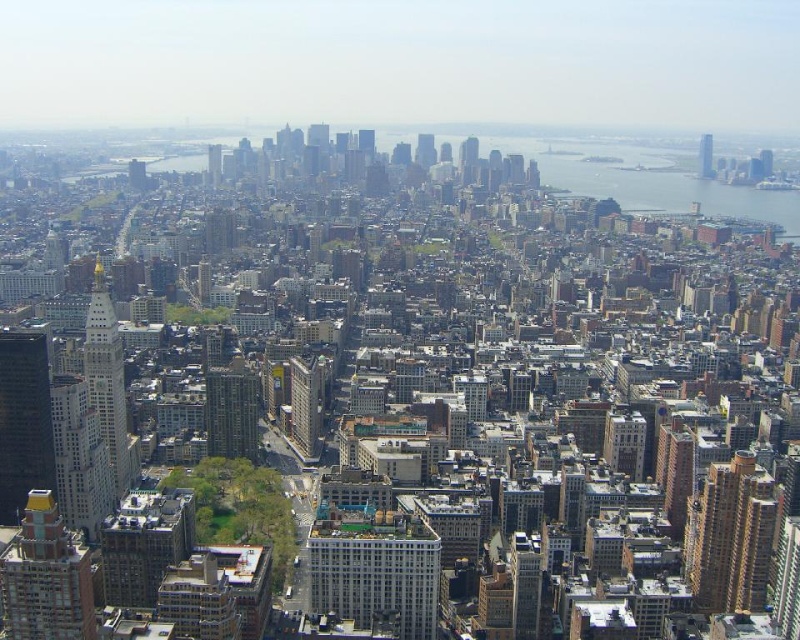
Question: Can you confirm if white glass skyscraper at left is positioned to the left of matte glass skyscraper at center?

Choices:
 (A) no
 (B) yes

Answer: (B)

Question: Which point is closer to the camera?

Choices:
 (A) green glass building at center
 (B) matte gray building at center
 (C) matte glass skyscraper at center
 (D) white marble tower at left

Answer: (B)

Question: Among these points, which one is farthest from the camera?

Choices:
 (A) (760, 150)
 (B) (38, 406)
 (C) (28, 592)

Answer: (C)

Question: Is shiny glass skyscraper at left closer to camera compared to white marble tower at left?

Choices:
 (A) no
 (B) yes

Answer: (A)

Question: Does gold-tipped brick building at lower left have a greater width compared to green glass building at center?

Choices:
 (A) yes
 (B) no

Answer: (A)

Question: Which object is positioned farthest from the glassy skyscraper at upper right?

Choices:
 (A) white glass skyscraper at left
 (B) green glass building at center
 (C) gold textured building at lower right

Answer: (A)